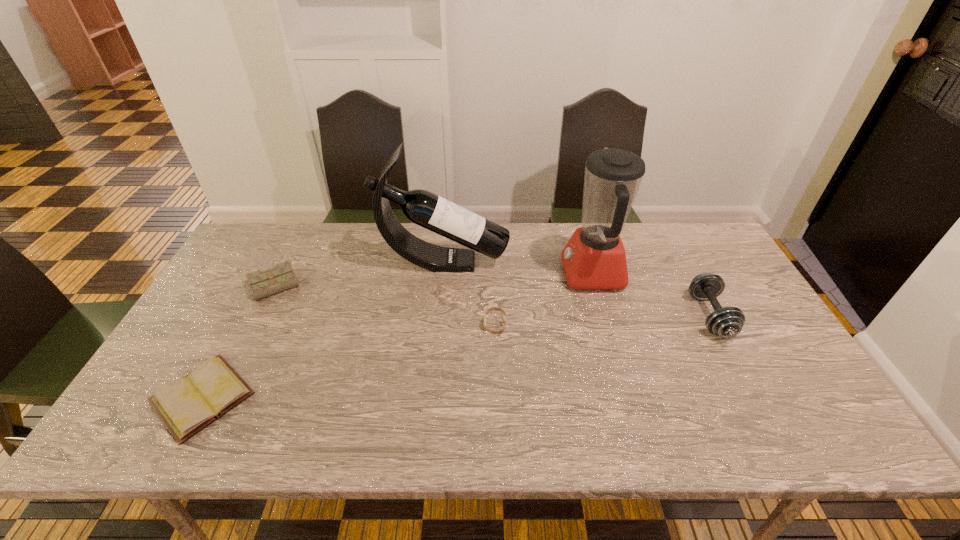
Locate an element on the screen. The height and width of the screenshot is (540, 960). object positioned at the near edge is located at coordinates (186, 406).

At what (x,y) coordinates should I click in order to perform the action: click on object located in the right edge section of the desktop. Please return your answer as a coordinate pair (x, y). The width and height of the screenshot is (960, 540). Looking at the image, I should click on (727, 322).

Where is `object located at the near left corner`? The height and width of the screenshot is (540, 960). object located at the near left corner is located at coordinates (186, 406).

Locate an element on the screen. vacant area at the far edge is located at coordinates (423, 235).

In the image, there is a desktop. Where is `vacant space at the near edge`? The image size is (960, 540). vacant space at the near edge is located at coordinates (236, 442).

In the image, there is a desktop. Identify the location of vacant space at the left edge. This screenshot has width=960, height=540. (204, 363).

Where is `vacant area at the right edge`? The width and height of the screenshot is (960, 540). vacant area at the right edge is located at coordinates (747, 314).

In the image, there is a desktop. Where is `vacant space at the far left corner`? The height and width of the screenshot is (540, 960). vacant space at the far left corner is located at coordinates (293, 230).

Where is `vacant space at the far right corner`? Image resolution: width=960 pixels, height=540 pixels. vacant space at the far right corner is located at coordinates (680, 260).

The width and height of the screenshot is (960, 540). Identify the location of vacant space at the near right corner of the desktop. (776, 421).